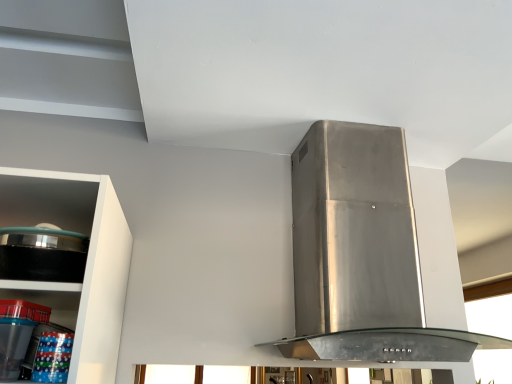
Question: From a real-world perspective, is black glossy pot at left positioned above or below stainless steel range hood at center?

Choices:
 (A) above
 (B) below

Answer: (B)

Question: Does point (47, 238) appear closer or farther from the camera than point (393, 244)?

Choices:
 (A) closer
 (B) farther

Answer: (A)

Question: Based on their relative distances, which object is farther from the clear plastic containers at lower left?

Choices:
 (A) transparent glass window at upper right
 (B) stainless steel range hood at center
 (C) black glossy pot at left

Answer: (A)

Question: Which object is positioned closest to the stainless steel range hood at center?

Choices:
 (A) transparent glass window at upper right
 (B) clear plastic containers at lower left
 (C) black glossy pot at left

Answer: (C)